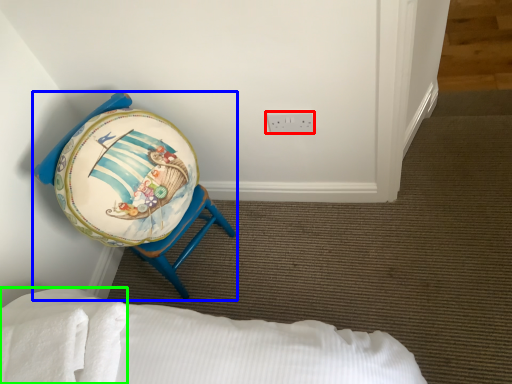
Question: Considering the real-world distances, which object is closest to electric outlet (highlighted by a red box)? furniture (highlighted by a blue box) or sheet (highlighted by a green box).

Choices:
 (A) furniture
 (B) sheet

Answer: (A)